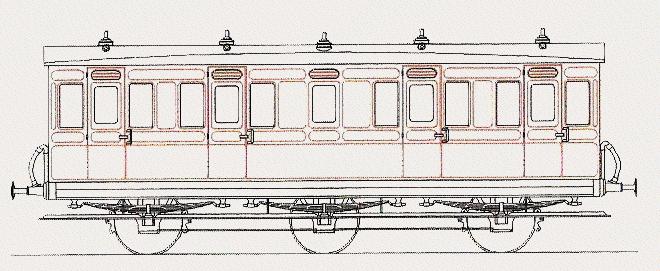
The image size is (660, 271). What are the coordinates of `door handle` in the screenshot? It's located at (446, 132).